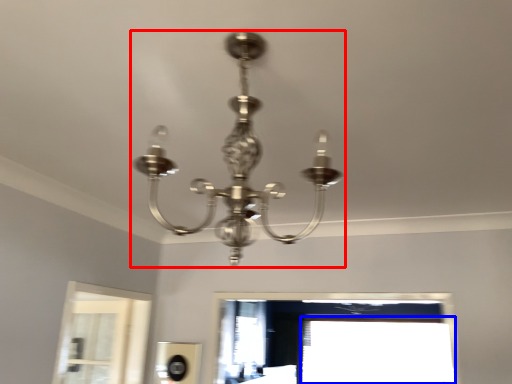
Question: Among these objects, which one is nearest to the camera, lamp (highlighted by a red box) or window (highlighted by a blue box)?

Choices:
 (A) lamp
 (B) window

Answer: (A)